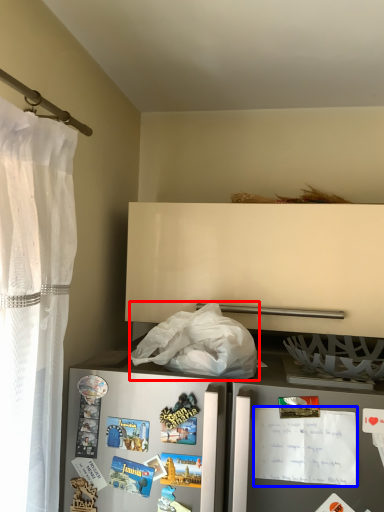
Question: Which object is closer to the camera taking this photo, plastic bag (highlighted by a red box) or postcard (highlighted by a blue box)?

Choices:
 (A) plastic bag
 (B) postcard

Answer: (B)